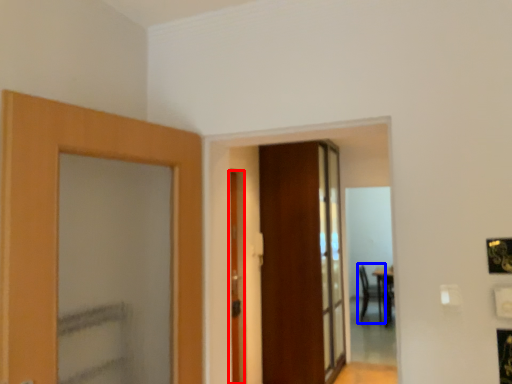
Question: Among these objects, which one is farthest to the camera, door (highlighted by a red box) or armchair (highlighted by a blue box)?

Choices:
 (A) door
 (B) armchair

Answer: (B)